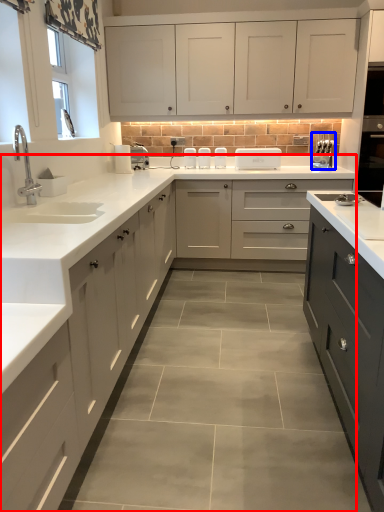
Question: Among these objects, which one is nearest to the camera, countertop (highlighted by a red box) or appliance (highlighted by a blue box)?

Choices:
 (A) countertop
 (B) appliance

Answer: (A)